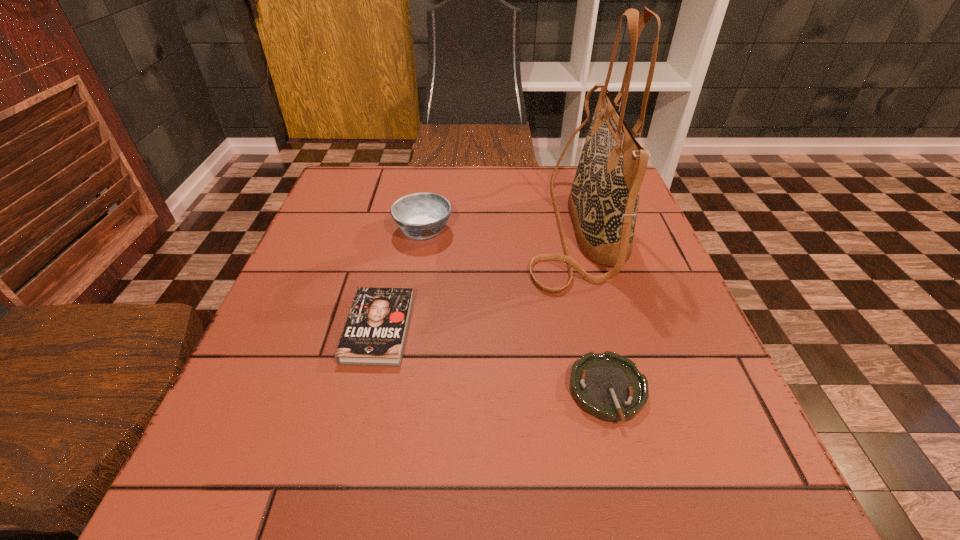
Find the location of a particular element. The width and height of the screenshot is (960, 540). empty space that is in between the third shortest object and the book is located at coordinates (401, 279).

At what (x,y) coordinates should I click in order to perform the action: click on vacant space that is in between the taller ashtray and the tallest object. Please return your answer as a coordinate pair (x, y). Looking at the image, I should click on (498, 228).

Identify the location of empty space between the right ashtray and the book. Image resolution: width=960 pixels, height=540 pixels. (493, 360).

In order to click on free space that is in between the taller ashtray and the shorter ashtray in this screenshot , I will do `click(516, 310)`.

Identify which object is the second closest to the handbag. Please provide its 2D coordinates. Your answer should be formatted as a tuple, i.e. [(x, y)], where the tuple contains the x and y coordinates of a point satisfying the conditions above.

[(421, 215)]

Image resolution: width=960 pixels, height=540 pixels. I want to click on the third closest object to the book, so 608,386.

Find the location of a particular element. This screenshot has height=540, width=960. vacant position in the image that satisfies the following two spatial constraints: 1. on the front side of the right ashtray; 2. on the right side of the farther ashtray is located at coordinates (397, 390).

At what (x,y) coordinates should I click in order to perform the action: click on free spot that satisfies the following two spatial constraints: 1. on the front-facing side of the tallest object; 2. on the front side of the book. Please return your answer as a coordinate pair (x, y). This screenshot has width=960, height=540. Looking at the image, I should click on (600, 328).